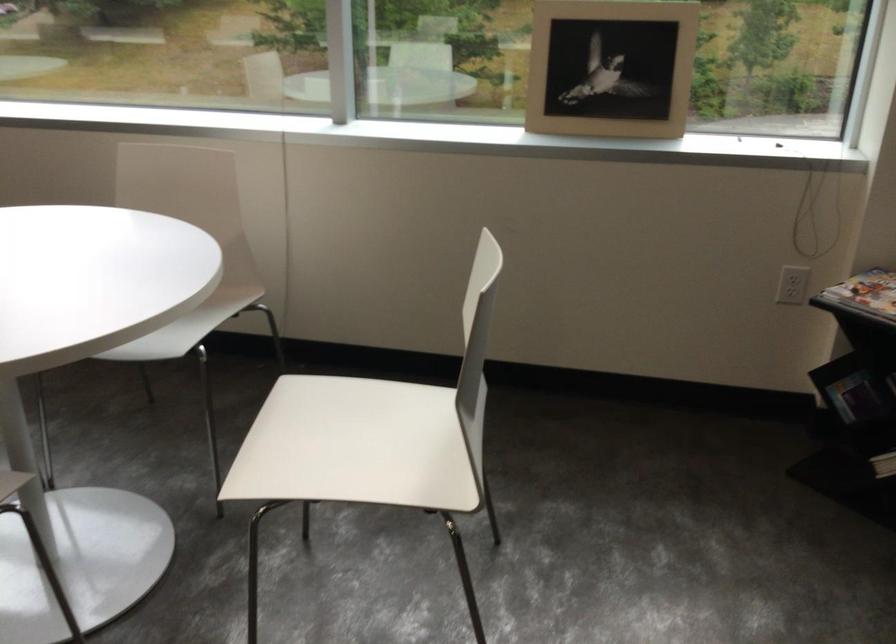
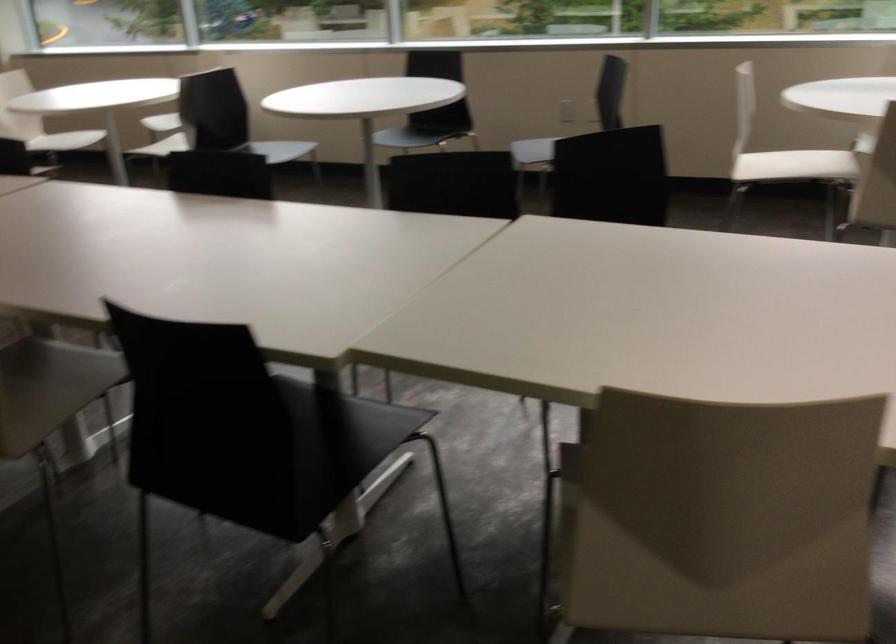
What movement of the cameraman would produce the second image?

The cameraman walked toward left, backward.